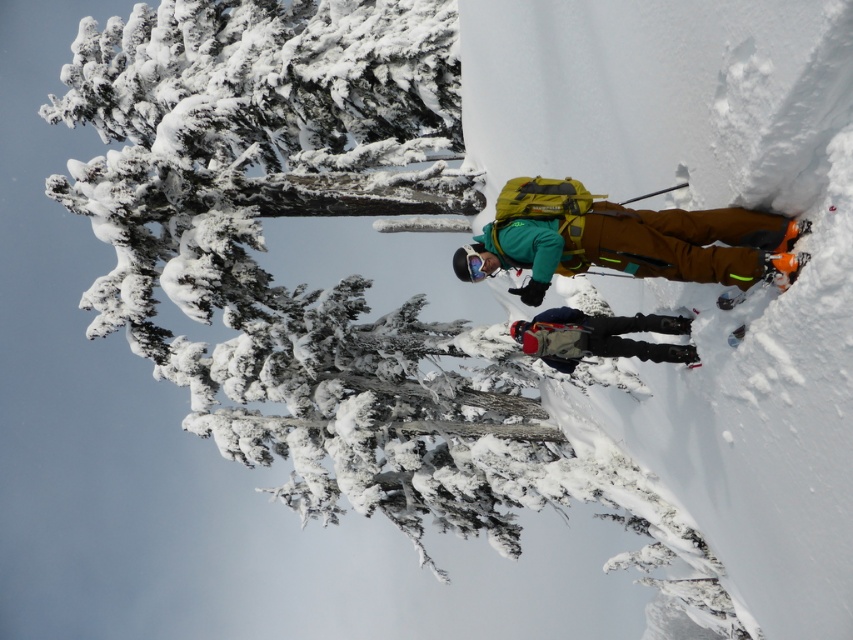
Does matte green jacket at center have a greater height compared to matte black backpack at center?

Yes.

Which is more to the right, matte green jacket at center or matte black backpack at center?

From the viewer's perspective, matte green jacket at center appears more on the right side.

This screenshot has height=640, width=853. Describe the element at coordinates (625, 240) in the screenshot. I see `matte green jacket at center` at that location.

Locate an element on the screen. matte green jacket at center is located at coordinates (625, 240).

Is snow-covered evergreen tree at upper left thinner than matte black backpack at center?

No.

Is snow-covered evergreen tree at upper left bigger than matte black backpack at center?

Yes, snow-covered evergreen tree at upper left is bigger than matte black backpack at center.

Who is more distant from viewer, (419, 301) or (608, 324)?

Positioned behind is point (419, 301).

Identify the location of snow-covered evergreen tree at upper left. This screenshot has height=640, width=853. (271, 205).

Is snow-covered evergreen tree at upper left in front of matte green jacket at center?

That is False.

Which of these two, snow-covered evergreen tree at upper left or matte green jacket at center, stands shorter?

matte green jacket at center

Locate an element on the screen. Image resolution: width=853 pixels, height=640 pixels. snow-covered evergreen tree at upper left is located at coordinates pyautogui.click(x=271, y=205).

The height and width of the screenshot is (640, 853). In order to click on snow-covered evergreen tree at upper left in this screenshot , I will do `click(271, 205)`.